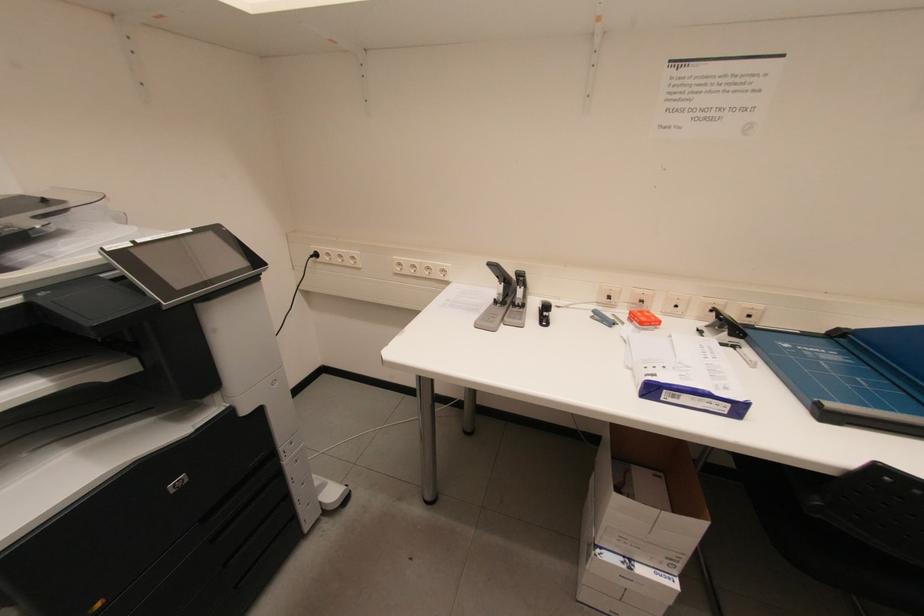
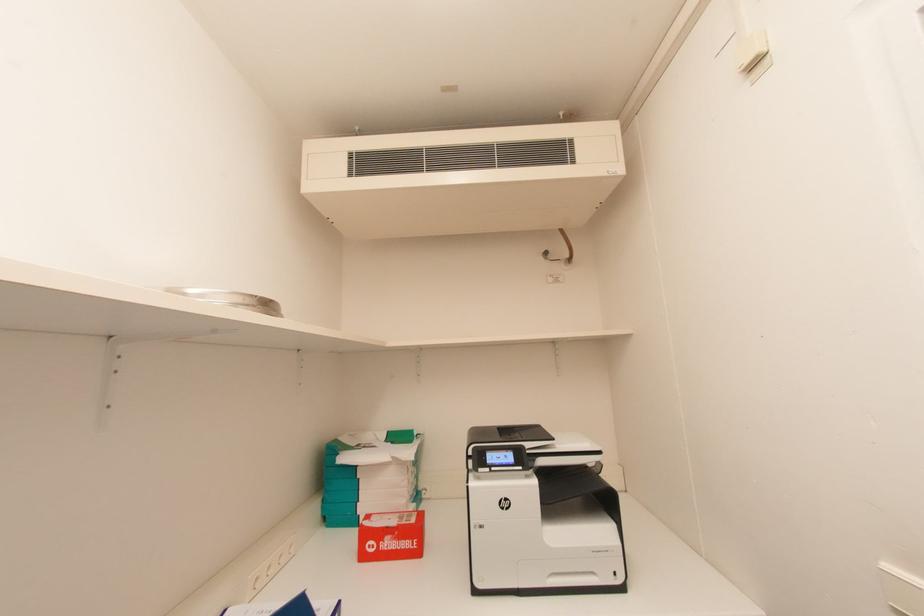
Question: The camera is either moving clockwise (left) or counter-clockwise (right) around the object. The first image is from the beginning of the video and the second image is from the end. Is the camera moving left or right when shooting the video?

Choices:
 (A) Left
 (B) Right

Answer: (A)